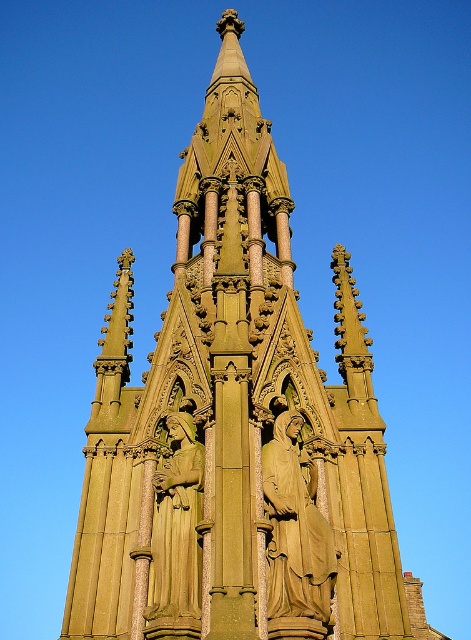
Question: Which point appears closest to the camera in this image?

Choices:
 (A) (199, 488)
 (B) (311, 573)

Answer: (B)

Question: Can you confirm if golden stone statue at center is thinner than green stone statue at center?

Choices:
 (A) no
 (B) yes

Answer: (A)

Question: From the image, what is the correct spatial relationship of golden stone statue at center in relation to green stone statue at center?

Choices:
 (A) below
 (B) above

Answer: (A)

Question: In this image, where is golden stone statue at center located relative to green stone statue at center?

Choices:
 (A) below
 (B) above

Answer: (A)

Question: Which of the following is the closest to the observer?

Choices:
 (A) green stone statue at center
 (B) golden stone statue at center

Answer: (A)